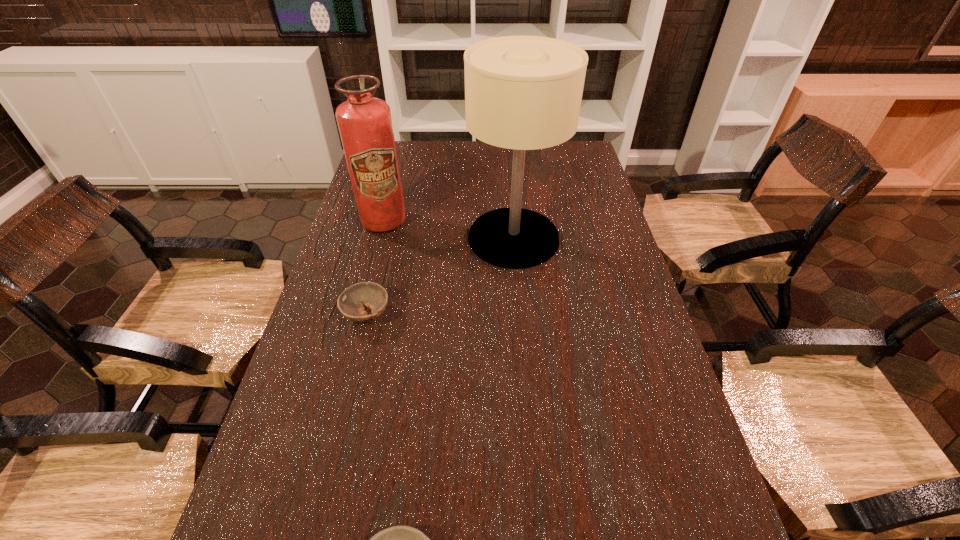
At what (x,y) coordinates should I click in order to perform the action: click on table lamp. Please return your answer as a coordinate pair (x, y). Image resolution: width=960 pixels, height=540 pixels. Looking at the image, I should click on (523, 93).

Locate an element on the screen. The image size is (960, 540). the rightmost object is located at coordinates (523, 93).

At what (x,y) coordinates should I click in order to perform the action: click on the third shortest object. Please return your answer as a coordinate pair (x, y). Looking at the image, I should click on (364, 122).

Image resolution: width=960 pixels, height=540 pixels. I want to click on the second shortest object, so click(x=350, y=303).

Where is `the left bowl`? the left bowl is located at coordinates (350, 303).

Image resolution: width=960 pixels, height=540 pixels. I want to click on free point located on the front of the table lamp, so click(x=518, y=291).

The height and width of the screenshot is (540, 960). I want to click on vacant position located 0.250m on the label side of the second tallest object, so click(366, 291).

The image size is (960, 540). What are the coordinates of `vacant space situated 0.320m on the back of the farther bowl` in the screenshot? It's located at (388, 227).

Locate an element on the screen. fire extinguisher present at the left edge is located at coordinates [x=364, y=122].

Find the location of a particular element. This screenshot has height=540, width=960. bowl that is at the left edge is located at coordinates point(350,303).